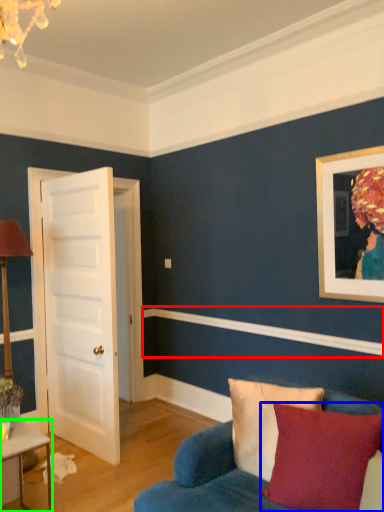
Question: Estimate the real-world distances between objects in this image. Which object is farther from molding (highlighted by a red box), pillow (highlighted by a blue box) or table (highlighted by a green box)?

Choices:
 (A) pillow
 (B) table

Answer: (B)